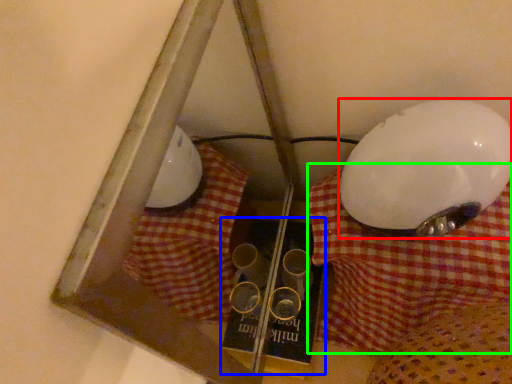
Question: Estimate the real-world distances between objects in this image. Which object is farther from lamp (highlighted by a red box), book (highlighted by a blue box) or tablecloth (highlighted by a green box)?

Choices:
 (A) book
 (B) tablecloth

Answer: (A)